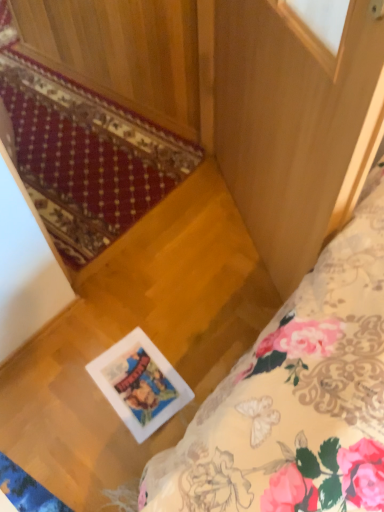
You are a GUI agent. You are given a task and a screenshot of the screen. Output one action in this format:
    pyautogui.click(x=<x>, y=<y>)
    Task: Click on the white glossy picture frame at center
    This screenshot has height=512, width=384.
    Given the screenshot: What is the action you would take?
    click(x=140, y=384)

Identify the location of red carpet at lower left. The image size is (384, 512). (86, 157).

How many degrees apart are the facing directions of wooden screen door at center and red carpet at lower left?

wooden screen door at center and red carpet at lower left are facing 125 degrees away from each other.

Find the location of `screen door in front of the red carpet at lower left`. screen door in front of the red carpet at lower left is located at coordinates (296, 122).

Between wooden screen door at center and red carpet at lower left, which one has smaller width?

With smaller width is red carpet at lower left.

Is white glossy picture frame at center touching red carpet at lower left?

white glossy picture frame at center is not next to red carpet at lower left, and they're not touching.

Does point (161, 392) appear closer or farther from the camera than point (116, 163)?

Point (161, 392) is closer to the camera than point (116, 163).

Between red carpet at lower left and floral fabric bed at lower right, which one has more height?

With more height is red carpet at lower left.

In the scene shown: Between red carpet at lower left and floral fabric bed at lower right, which one appears on the right side from the viewer's perspective?

floral fabric bed at lower right.

The width and height of the screenshot is (384, 512). Identify the location of bed behind the red carpet at lower left. (296, 397).

Is floral fabric bed at lower right looking in the opposite direction of white glossy picture frame at center?

Yes.

The width and height of the screenshot is (384, 512). In order to click on picture frame below the floral fabric bed at lower right (from the image's perspective) in this screenshot , I will do `click(140, 384)`.

From a real-world perspective, is floral fabric bed at lower right under white glossy picture frame at center?

No, from a real-world perspective, floral fabric bed at lower right is not beneath white glossy picture frame at center.

Is point (334, 261) positioned after point (144, 437)?

That is False.

Is wooden screen door at center facing towards floral fabric bed at lower right?

Yes, wooden screen door at center faces towards floral fabric bed at lower right.

Where is `bed that appears below the wooden screen door at center (from the image's perspective)`? Image resolution: width=384 pixels, height=512 pixels. bed that appears below the wooden screen door at center (from the image's perspective) is located at coordinates (296, 397).

Is wooden screen door at center next to floral fabric bed at lower right?

No.

In terms of size, does wooden screen door at center appear bigger or smaller than floral fabric bed at lower right?

Clearly, wooden screen door at center is larger in size than floral fabric bed at lower right.

Who is bigger, red carpet at lower left or white glossy picture frame at center?

With larger size is red carpet at lower left.

Considering the sizes of objects red carpet at lower left and white glossy picture frame at center in the image provided, who is wider, red carpet at lower left or white glossy picture frame at center?

white glossy picture frame at center.

From the picture: Considering the relative sizes of red carpet at lower left and white glossy picture frame at center in the image provided, is red carpet at lower left shorter than white glossy picture frame at center?

In fact, red carpet at lower left may be taller than white glossy picture frame at center.

Which object is wider, floral fabric bed at lower right or red carpet at lower left?

With larger width is floral fabric bed at lower right.

Considering the positions of points (375, 301) and (86, 233), is point (375, 301) closer to camera compared to point (86, 233)?

Yes, point (375, 301) is closer to viewer.

Is the depth of floral fabric bed at lower right greater than that of red carpet at lower left?

Yes, floral fabric bed at lower right is behind red carpet at lower left.

How many degrees apart are the facing directions of floral fabric bed at lower right and red carpet at lower left?

floral fabric bed at lower right and red carpet at lower left are facing 180 degrees away from each other.

Where is `mat lying on the left of wooden screen door at center`? The height and width of the screenshot is (512, 384). mat lying on the left of wooden screen door at center is located at coordinates (86, 157).

Where is `picture frame below the red carpet at lower left (from the image's perspective)`? The width and height of the screenshot is (384, 512). picture frame below the red carpet at lower left (from the image's perspective) is located at coordinates (140, 384).

Based on their spatial positions, is wooden screen door at center or red carpet at lower left further from floral fabric bed at lower right?

Based on the image, red carpet at lower left appears to be further to floral fabric bed at lower right.

Looking at the image, which one is located further to wooden screen door at center, floral fabric bed at lower right or white glossy picture frame at center?

Among the two, white glossy picture frame at center is located further to wooden screen door at center.

Looking at the image, which one is located closer to red carpet at lower left, floral fabric bed at lower right or wooden screen door at center?

wooden screen door at center is positioned closer to the anchor red carpet at lower left.

Which object lies further to the anchor point white glossy picture frame at center, red carpet at lower left or wooden screen door at center?

red carpet at lower left.

Considering their positions, is wooden screen door at center positioned closer to white glossy picture frame at center than red carpet at lower left?

Among the two, wooden screen door at center is located nearer to white glossy picture frame at center.

Based on the photo, from the image, which object appears to be nearer to red carpet at lower left, white glossy picture frame at center or floral fabric bed at lower right?

white glossy picture frame at center is positioned closer to the anchor red carpet at lower left.

From the image, which object appears to be farther from floral fabric bed at lower right, red carpet at lower left or wooden screen door at center?

red carpet at lower left.

Considering their positions, is white glossy picture frame at center positioned further to wooden screen door at center than red carpet at lower left?

red carpet at lower left lies further to wooden screen door at center than the other object.

You are a GUI agent. You are given a task and a screenshot of the screen. Output one action in this format:
    pyautogui.click(x=<x>, y=<y>)
    Task: Click on the bed between wooden screen door at center and white glossy picture frame at center from top to bottom
    This screenshot has width=384, height=512.
    Given the screenshot: What is the action you would take?
    pyautogui.click(x=296, y=397)

This screenshot has width=384, height=512. What are the coordinates of `screen door that lies between red carpet at lower left and floral fabric bed at lower right from top to bottom` in the screenshot? It's located at (296, 122).

Identify the location of bed between red carpet at lower left and white glossy picture frame at center in the vertical direction. (296, 397).

Locate an element on the screen. screen door between red carpet at lower left and white glossy picture frame at center vertically is located at coordinates (296, 122).